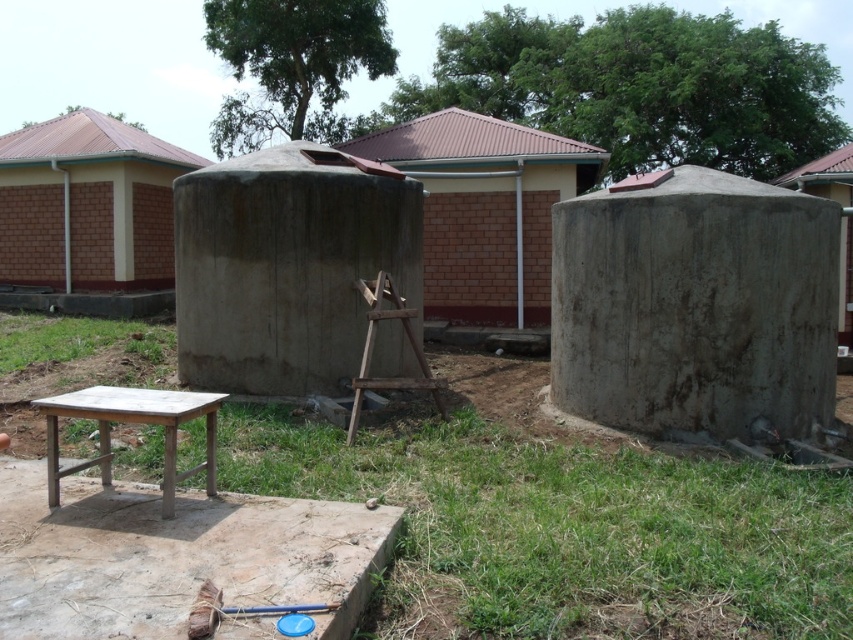
Image resolution: width=853 pixels, height=640 pixels. In order to click on wooden table at lower left in this screenshot , I will do `click(131, 420)`.

In order to click on wooden table at lower left in this screenshot , I will do `click(131, 420)`.

From the picture: Between brown brick wall at left and concrete hut at center, which one is positioned higher?

brown brick wall at left is higher up.

Does brown brick wall at left appear over concrete hut at center?

Indeed, brown brick wall at left is positioned over concrete hut at center.

This screenshot has width=853, height=640. What do you see at coordinates (86, 216) in the screenshot?
I see `brown brick wall at left` at bounding box center [86, 216].

You are a GUI agent. You are given a task and a screenshot of the screen. Output one action in this format:
    pyautogui.click(x=<x>, y=<y>)
    Task: Click on the brown brick wall at left
    The image size is (853, 640).
    Given the screenshot: What is the action you would take?
    pyautogui.click(x=86, y=216)

How much distance is there between brown brick wall at left and gray concrete tank at center?

brown brick wall at left and gray concrete tank at center are 46.69 feet apart.

How distant is brown brick wall at left from gray concrete tank at center?

A distance of 46.69 feet exists between brown brick wall at left and gray concrete tank at center.

Image resolution: width=853 pixels, height=640 pixels. Describe the element at coordinates (86, 216) in the screenshot. I see `brown brick wall at left` at that location.

At what (x,y) coordinates should I click in order to perform the action: click on brown brick wall at left. Please return your answer as a coordinate pair (x, y). This screenshot has width=853, height=640. Looking at the image, I should click on (86, 216).